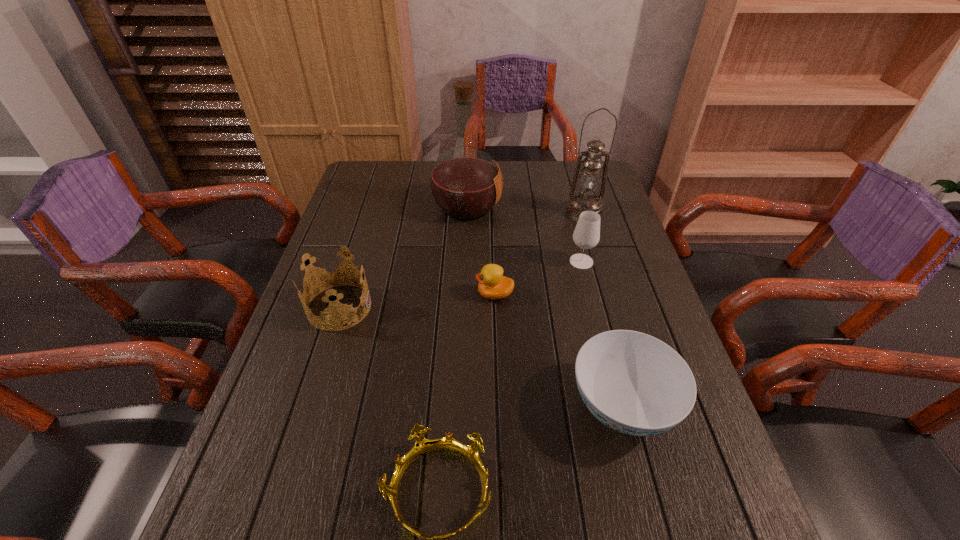
In the image, there is a desktop. At what (x,y) coordinates should I click in order to perform the action: click on vacant area at the far edge. Please return your answer as a coordinate pair (x, y). Looking at the image, I should click on (409, 185).

Identify the location of free region at the left edge. (286, 360).

This screenshot has width=960, height=540. I want to click on free space at the right edge, so click(611, 241).

Where is `vacant space in between the liquor and the left crown`? Image resolution: width=960 pixels, height=540 pixels. vacant space in between the liquor and the left crown is located at coordinates (403, 257).

Find the location of `blank region between the fifth tallest object and the leftmost object`. blank region between the fifth tallest object and the leftmost object is located at coordinates (481, 357).

At what (x,y) coordinates should I click in order to perform the action: click on empty location between the fifth tallest object and the liquor. Please return your answer as a coordinate pair (x, y). This screenshot has height=540, width=960. Looking at the image, I should click on (544, 307).

Locate an element on the screen. The width and height of the screenshot is (960, 540). free spot between the liquor and the fifth nearest object is located at coordinates (524, 234).

Point out which object is positioned as the second nearest to the liquor. Please provide its 2D coordinates. Your answer should be formatted as a tuple, i.e. [(x, y)], where the tuple contains the x and y coordinates of a point satisfying the conditions above.

[(586, 235)]

What are the coordinates of `object identified as the third closest to the liquor` in the screenshot? It's located at (492, 284).

Where is `free space that satisfies the following two spatial constraints: 1. on the front label of the liquor; 2. on the right side of the oil lamp`? free space that satisfies the following two spatial constraints: 1. on the front label of the liquor; 2. on the right side of the oil lamp is located at coordinates (467, 212).